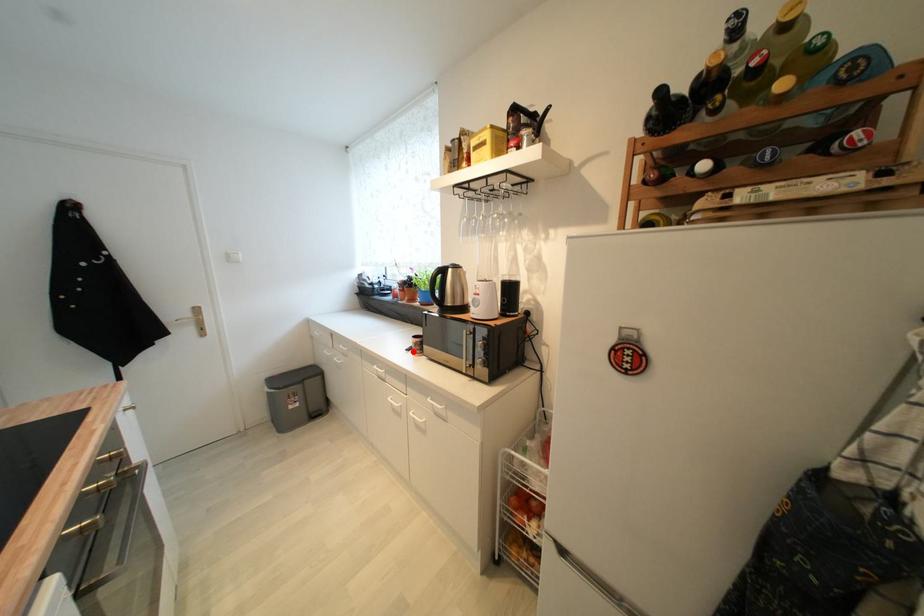
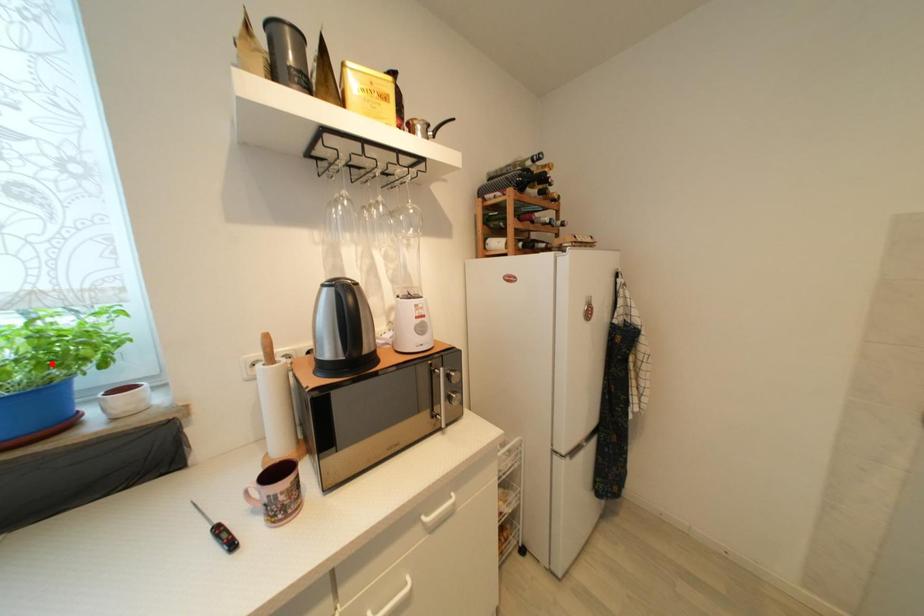
I am providing you with two images of the same scene from different viewpoints. A red point is marked on the first image and another point is marked on the second image. Is the red point in image1 aligned with the point shown in image2?

No